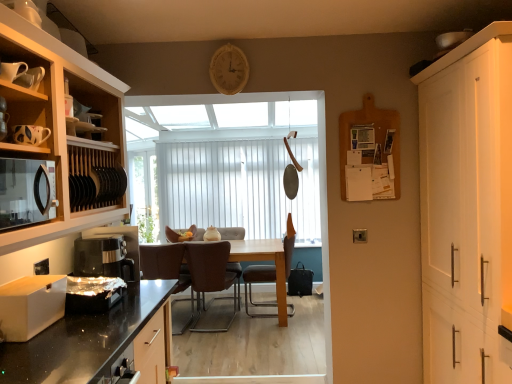
Question: Does point (153, 256) appear closer or farther from the camera than point (283, 253)?

Choices:
 (A) closer
 (B) farther

Answer: (A)

Question: From a real-world perspective, relative to brown leather chair at center, the third chair from the left, is brown leather chair at center, arranged as the 3th chair when viewed from the right, vertically above or below?

Choices:
 (A) above
 (B) below

Answer: (B)

Question: Which object is positioned closest to the brown leather chair at center, marked as the 1th chair in a right-to-left arrangement?

Choices:
 (A) white vertical blinds at center
 (B) brown leather chair at center, which ranks as the 2th chair in right-to-left order
 (C) white matte drawer at lower left, marked as the second appliance in a right-to-left arrangement
 (D) white matte cabinet at right, the first cabinetry when ordered from right to left
 (E) black matte microwave at left

Answer: (B)

Question: Which is nearer to the white vertical blinds at center?

Choices:
 (A) wooden clock at upper center
 (B) black plastic coffee machine at lower left
 (C) brown leather chair at center, marked as the 1th chair in a right-to-left arrangement
 (D) white matte drawer at lower left, acting as the 1th appliance starting from the front
 (E) white matte cabinet at right, the second cabinetry from the left

Answer: (C)